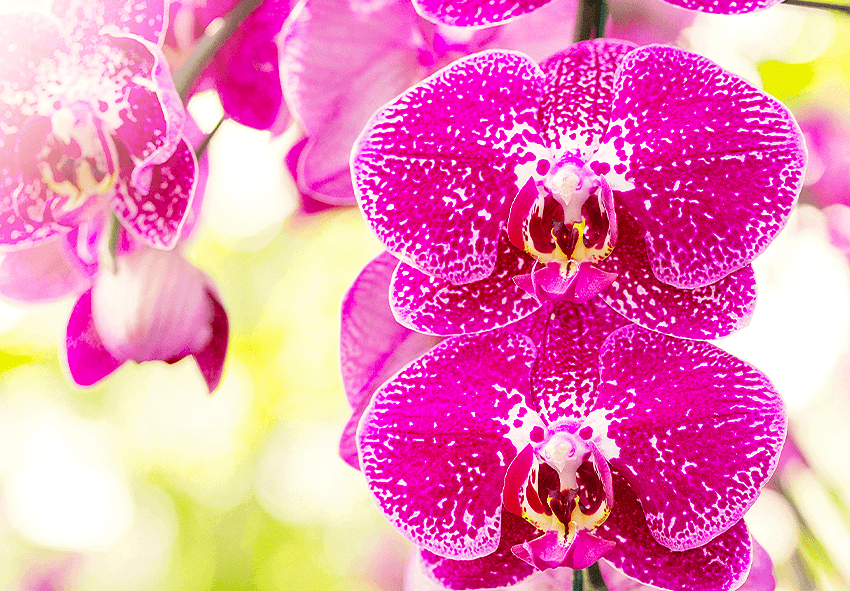
The width and height of the screenshot is (850, 591). I want to click on light, so click(x=805, y=292).